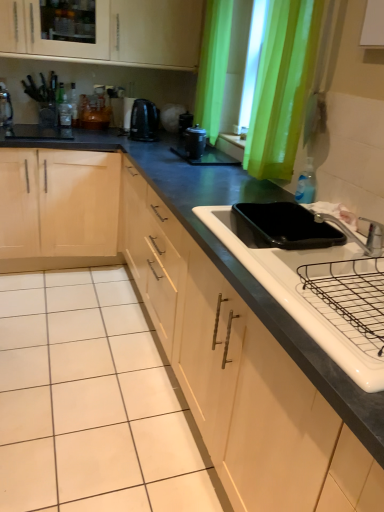
Find the location of `free space in front of silver metallic faucet at upper right`. free space in front of silver metallic faucet at upper right is located at coordinates (352, 281).